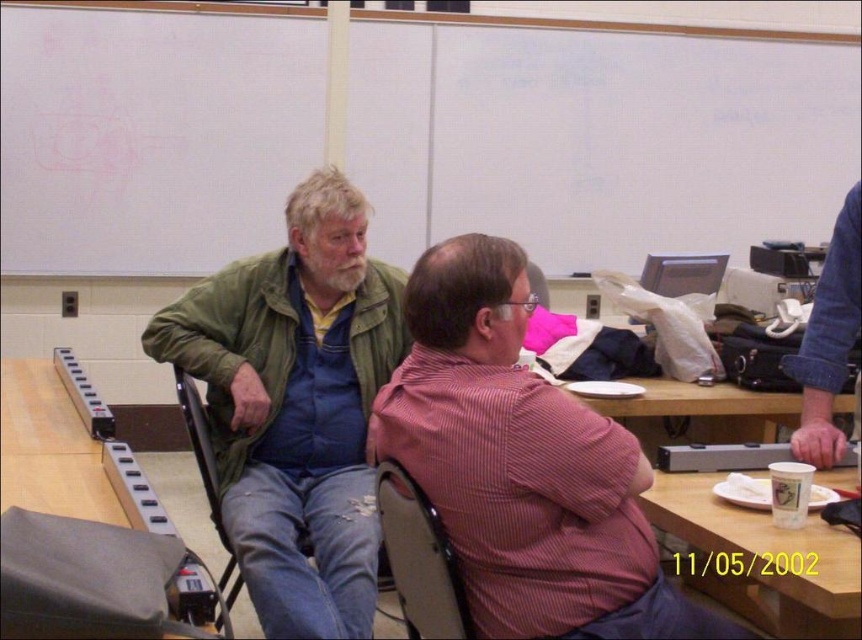
You are a person standing behind the matte plastic chair at center in a classroom. You want to walk to the door located behind the green fabric chair at left. Can you easily walk around the chair to reach the door?

The green fabric chair at left is in front of the matte plastic chair at center, so you are behind the matte plastic chair at center. To reach the door behind the green fabric chair at left, you need to move around the matte plastic chair at center first. Since the green fabric chair at left is closer to the door, you can walk around the matte plastic chair at center and then proceed to the door behind the green fabric chair at left.

Based on the photo, you are standing in front of the table in the classroom. There are two points marked on the table surface. The first point is at coordinates point [750,541] and the second point is at point [223,531]. If you want to place a small object closer to you, which point should you choose?

You should choose point [750,541] because it is closer to the viewer than point [223,531].

You are organizing a small event and need to know if the green matte jacket at center can be placed on the green fabric chair at left without covering its seat. Based on their sizes, what do you think?

The green matte jacket at center is smaller than the green fabric chair at left, so it can be placed on the green fabric chair at left without covering its seat.